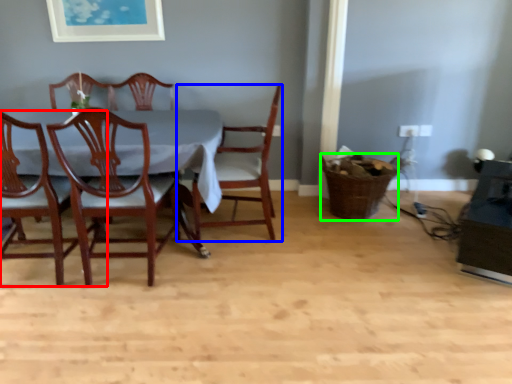
Question: Considering the real-world distances, which object is closest to chair (highlighted by a red box)? chair (highlighted by a blue box) or basket (highlighted by a green box).

Choices:
 (A) chair
 (B) basket

Answer: (A)